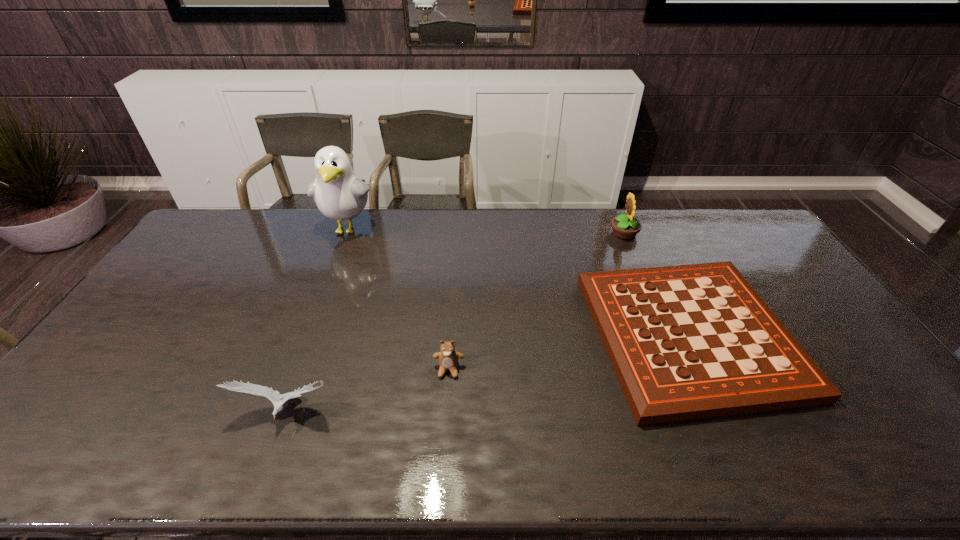
Identify the location of free point between the third shortest object and the teddy bear. (368, 391).

Locate an element on the screen. The width and height of the screenshot is (960, 540). empty space that is in between the taller gull and the nearer gull is located at coordinates (318, 321).

This screenshot has height=540, width=960. In order to click on free space between the sunflower and the tallest object in this screenshot , I will do `click(487, 231)`.

Identify the location of free spot between the teddy bear and the third shortest object. The image size is (960, 540). (368, 391).

Where is `unoccupied area between the teddy bear and the farther gull`? The width and height of the screenshot is (960, 540). unoccupied area between the teddy bear and the farther gull is located at coordinates (398, 299).

Where is `vacant area that lies between the third tallest object and the tallest object`? vacant area that lies between the third tallest object and the tallest object is located at coordinates (318, 321).

Find the location of a particular element. This screenshot has width=960, height=540. vacant point located between the teddy bear and the sunflower is located at coordinates (537, 301).

Locate an element on the screen. The image size is (960, 540). free space between the sunflower and the taller gull is located at coordinates (487, 231).

You are a GUI agent. You are given a task and a screenshot of the screen. Output one action in this format:
    pyautogui.click(x=<x>, y=<y>)
    Task: Click on the vacant area that lies between the gameboard and the tallest object
    
    Given the screenshot: What is the action you would take?
    pyautogui.click(x=519, y=282)

Locate an element on the screen. empty location between the third tallest object and the taller gull is located at coordinates (318, 321).